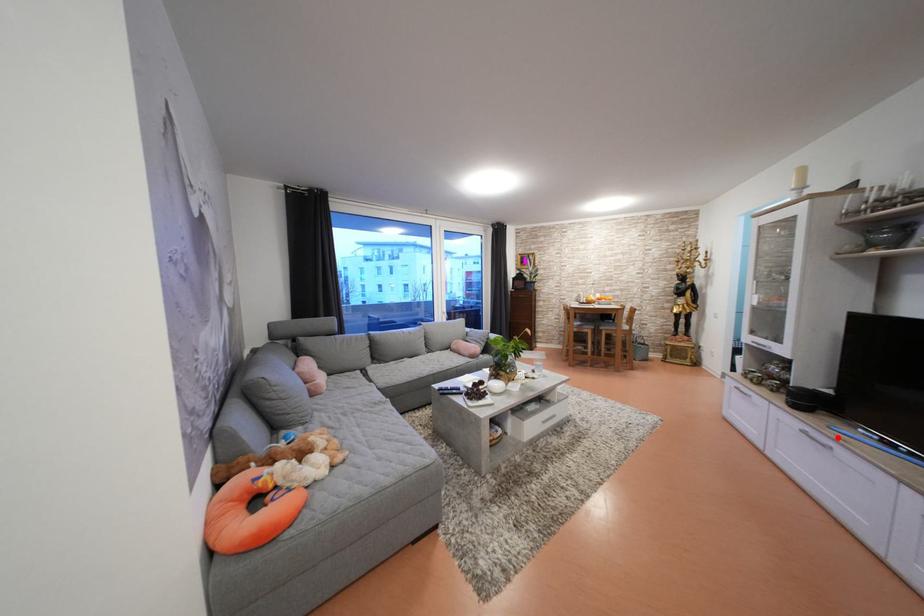
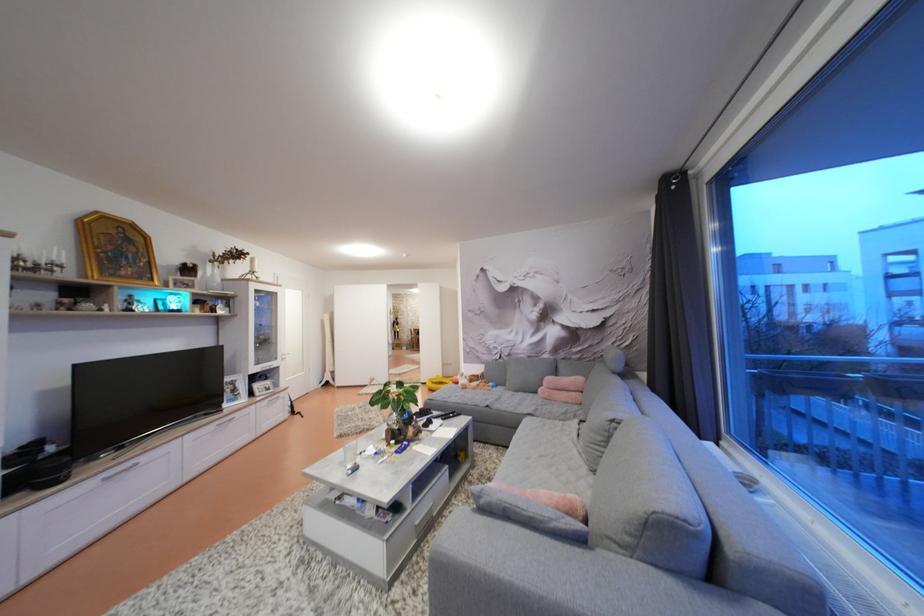
Question: I am providing you with two images of the same scene from different viewpoints. A red point is marked on the first image. Can you still see the location of the red point in image 2?

Choices:
 (A) Yes
 (B) No

Answer: (A)